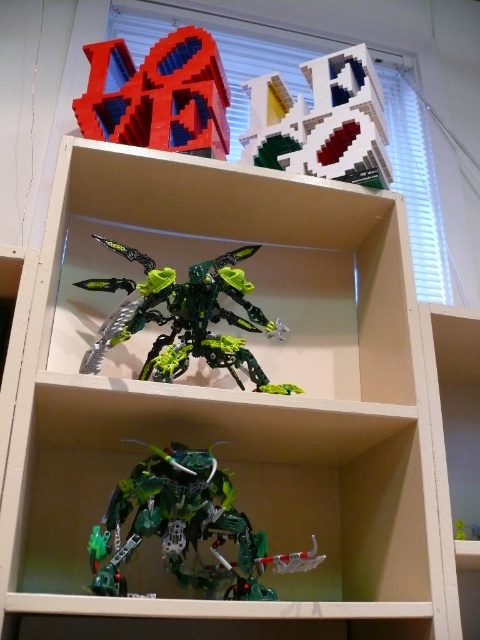
What object is located at the coordinates point [157,96] in the image?

The point [157,96] indicates brick like plastic letters at upper center.

You are standing in front of a LEGO display and see two points marked on the image. The first point is at coordinates point (240, 561) and the second is at point (371, 113). Which point is closer to you?

Point (240, 561) is in front of point (371, 113), so the first point is closer to you.